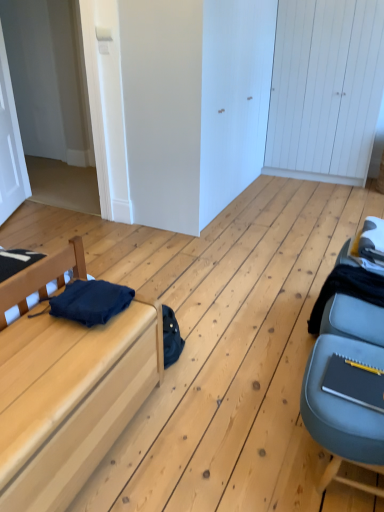
Question: Considering the relative positions of black fabric at right, which is the first clothing from back to front, and white matte door at upper left, the 1th door when ordered from front to back, in the image provided, is black fabric at right, which is the first clothing from back to front, to the left of white matte door at upper left, the 1th door when ordered from front to back, from the viewer's perspective?

Choices:
 (A) no
 (B) yes

Answer: (A)

Question: Is black fabric at right, which is the second clothing from left to right, completely or partially outside of white matte door at upper left, the 2th door from the right?

Choices:
 (A) yes
 (B) no

Answer: (A)

Question: Is black fabric at right, which is the first clothing from back to front, placed right next to white matte door at upper left, the first door in the left-to-right sequence?

Choices:
 (A) yes
 (B) no

Answer: (B)

Question: Can you confirm if black fabric at right, which is the second clothing from left to right, is positioned to the right of white matte door at upper left, which is the 2th door from back to front?

Choices:
 (A) yes
 (B) no

Answer: (A)

Question: Can you confirm if black fabric at right, which is the second clothing from left to right, is taller than white matte door at upper left, the 1th door when ordered from front to back?

Choices:
 (A) yes
 (B) no

Answer: (B)

Question: From a real-world perspective, is black fabric at right, which appears as the first clothing when viewed from the right, over white matte door at upper left, the 2th door from the right?

Choices:
 (A) no
 (B) yes

Answer: (A)

Question: Is black fabric at right, which appears as the first clothing when viewed from the right, positioned beyond the bounds of matte wood bed at left?

Choices:
 (A) yes
 (B) no

Answer: (A)

Question: Is black fabric at right, which is the second clothing from left to right, positioned with its back to matte wood bed at left?

Choices:
 (A) yes
 (B) no

Answer: (B)

Question: From the image's perspective, is black fabric at right, which is the second clothing from left to right, located beneath matte wood bed at left?

Choices:
 (A) yes
 (B) no

Answer: (B)

Question: Is black fabric at right, which is the second clothing from left to right, directly adjacent to matte wood bed at left?

Choices:
 (A) yes
 (B) no

Answer: (B)

Question: From the image's perspective, is black fabric at right, which is the second clothing from left to right, above matte wood bed at left?

Choices:
 (A) yes
 (B) no

Answer: (A)

Question: From a real-world perspective, does black fabric at right, which is the second clothing from left to right, stand above matte wood bed at left?

Choices:
 (A) yes
 (B) no

Answer: (B)

Question: Can you confirm if white wooden door at upper right, positioned as the 2th door in left-to-right order, is bigger than matte wood bed at left?

Choices:
 (A) yes
 (B) no

Answer: (A)